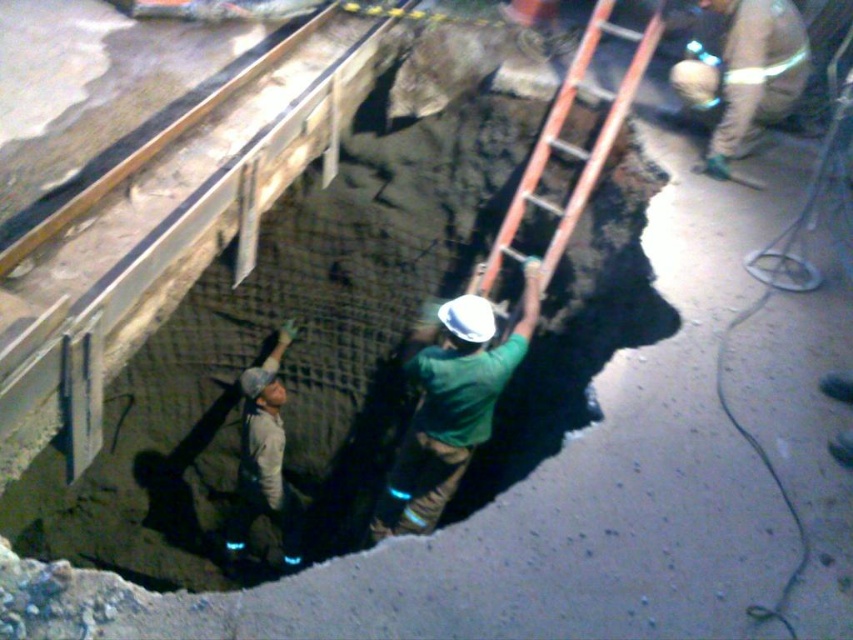
You are a safety inspector reviewing the construction site image. The safety guidelines state that all hard hats must be placed on the ground near the ladder for inspection. The ladder is positioned at point 0.636, 0.531. Is the green matte helmet at center positioned correctly for inspection according to the guidelines?

The green matte helmet at center is located at point [451,406], which matches the ladder position. Therefore, it is correctly placed near the ladder for inspection as required by the guidelines.

You are observing the construction site from a safe distance. You notice two workers in the scene. One is wearing light brown leather pants at upper right and the other is a tan fabric construction worker at lower left. Which worker is closer to you?

The light brown leather pants at upper right is in front of the tan fabric construction worker at lower left, so the worker wearing light brown leather pants at upper right is closer to you.